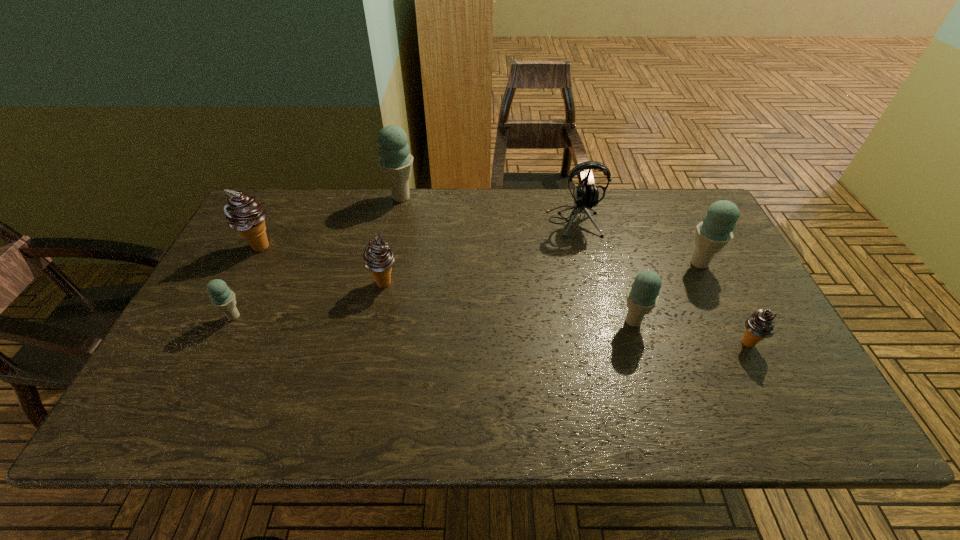
Find the location of `the farthest ice cream`. the farthest ice cream is located at coordinates (x=395, y=162).

Where is `the biggest blue ice cream`? The image size is (960, 540). the biggest blue ice cream is located at coordinates (395, 162).

Identify the location of black earphone. This screenshot has height=540, width=960. (585, 196).

What are the coordinates of `the farthest chocolate icecream` in the screenshot? It's located at (243, 213).

Where is `the biggest chocolate icecream`? Image resolution: width=960 pixels, height=540 pixels. the biggest chocolate icecream is located at coordinates (243, 213).

Find the location of a particular element. This screenshot has width=960, height=540. the third nearest blue ice cream is located at coordinates (715, 231).

This screenshot has height=540, width=960. I want to click on the rightmost blue ice cream, so click(715, 231).

At what (x,y) coordinates should I click in order to perform the action: click on the second smallest chocolate icecream. Please return your answer as a coordinate pair (x, y). Looking at the image, I should click on (378, 257).

You are a GUI agent. You are given a task and a screenshot of the screen. Output one action in this format:
    pyautogui.click(x=<x>, y=<y>)
    Task: Click on the second farthest chocolate icecream
    
    Given the screenshot: What is the action you would take?
    pyautogui.click(x=378, y=257)

Locate an element on the screen. the fifth ice cream from left to right is located at coordinates (642, 296).